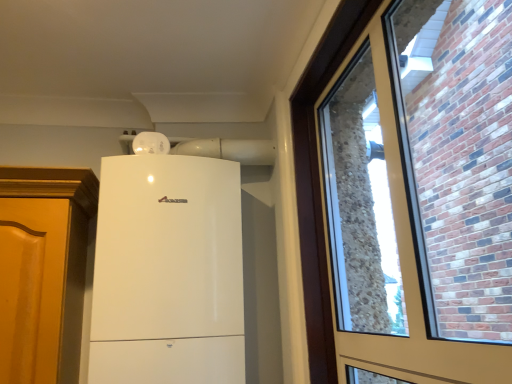
Question: From their relative heights in the image, would you say white glossy refrigerator at upper center is taller or shorter than matte glass window at right?

Choices:
 (A) short
 (B) tall

Answer: (B)

Question: Is white glossy refrigerator at upper center inside the boundaries of matte glass window at right, or outside?

Choices:
 (A) inside
 (B) outside

Answer: (B)

Question: Relative to matte glass window at right, is white glossy refrigerator at upper center in front or behind?

Choices:
 (A) front
 (B) behind

Answer: (B)

Question: Considering their positions, is matte glass window at right located in front of or behind white glossy refrigerator at upper center?

Choices:
 (A) behind
 (B) front

Answer: (B)

Question: Considering the relative positions of matte glass window at right and white glossy refrigerator at upper center in the image provided, is matte glass window at right to the left or to the right of white glossy refrigerator at upper center?

Choices:
 (A) left
 (B) right

Answer: (B)

Question: From a real-world perspective, is matte glass window at right above or below white glossy refrigerator at upper center?

Choices:
 (A) below
 (B) above

Answer: (B)

Question: Is matte glass window at right taller or shorter than white glossy refrigerator at upper center?

Choices:
 (A) short
 (B) tall

Answer: (A)